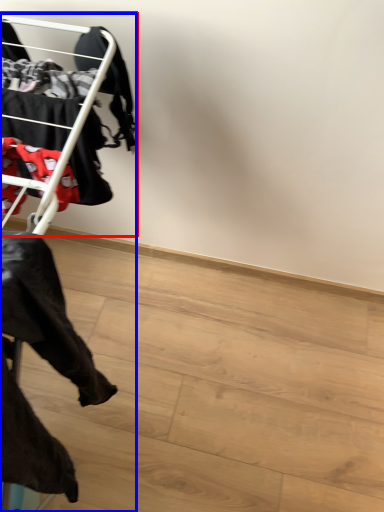
Question: Which point is further to the camera, bunk bed (highlighted by a red box) or furniture (highlighted by a blue box)?

Choices:
 (A) bunk bed
 (B) furniture

Answer: (A)